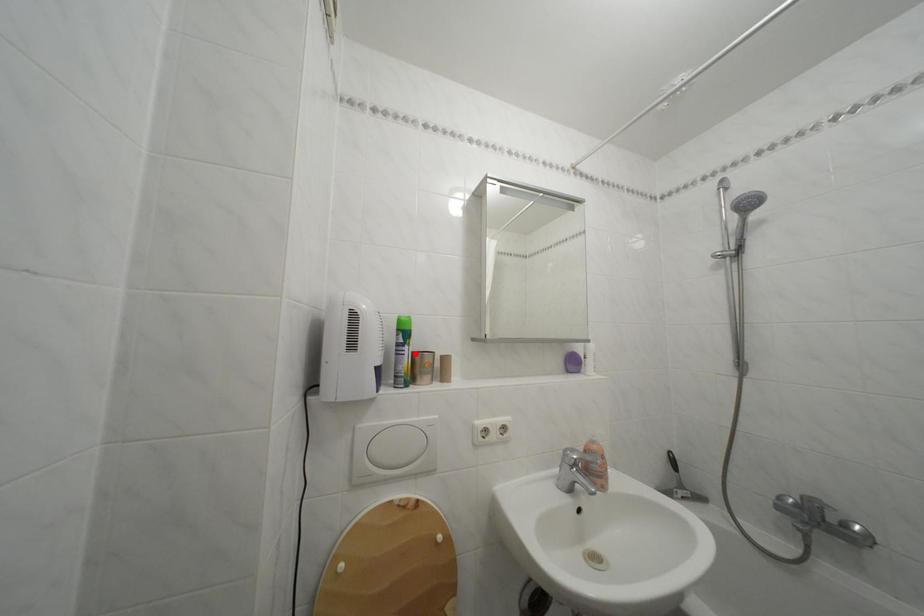
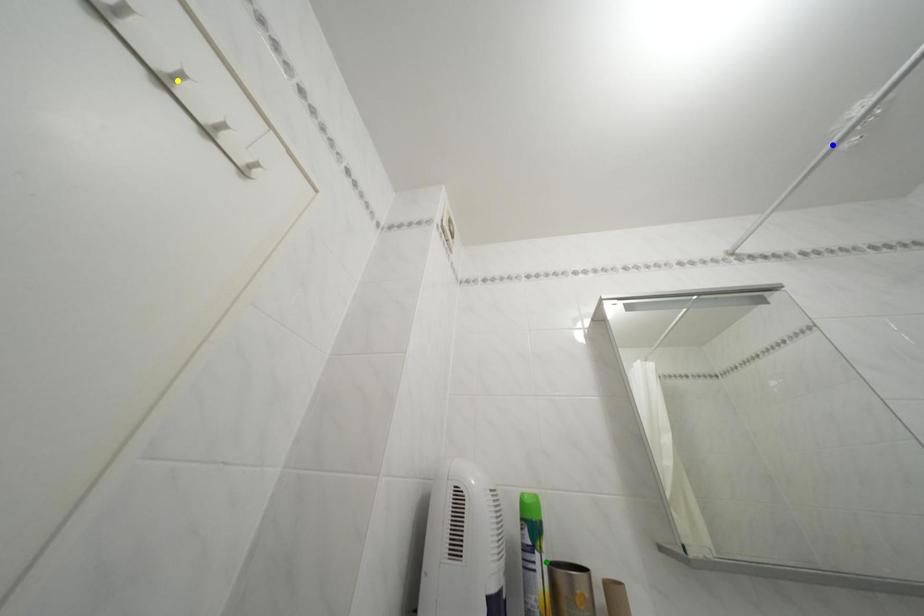
Question: I am providing you with two images of the same scene from different viewpoints. A red point is marked on the first image. You are given multiple points on the second image. In image 2, which mark is for the same physical point as the one in image 1?

Choices:
 (A) yellow point
 (B) green point
 (C) blue point

Answer: (B)